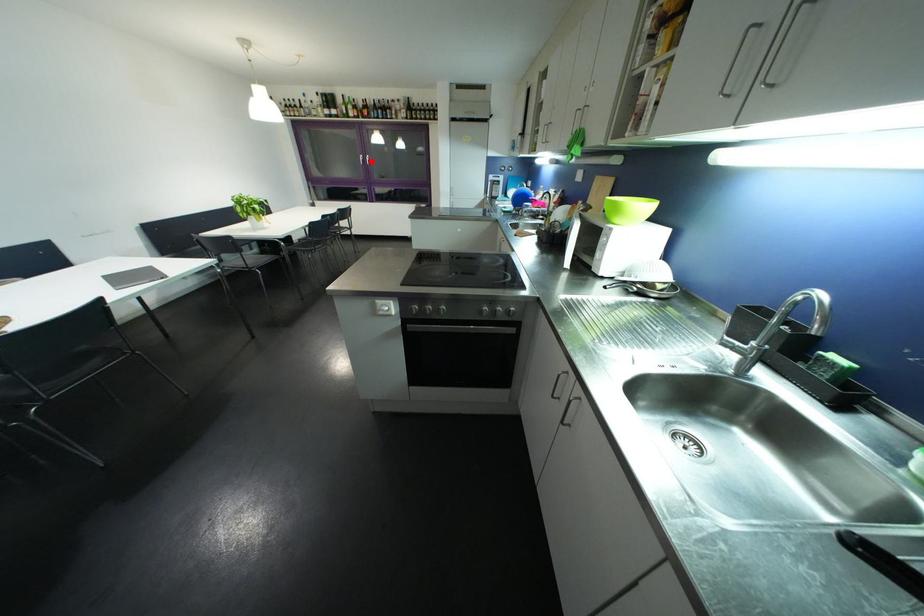
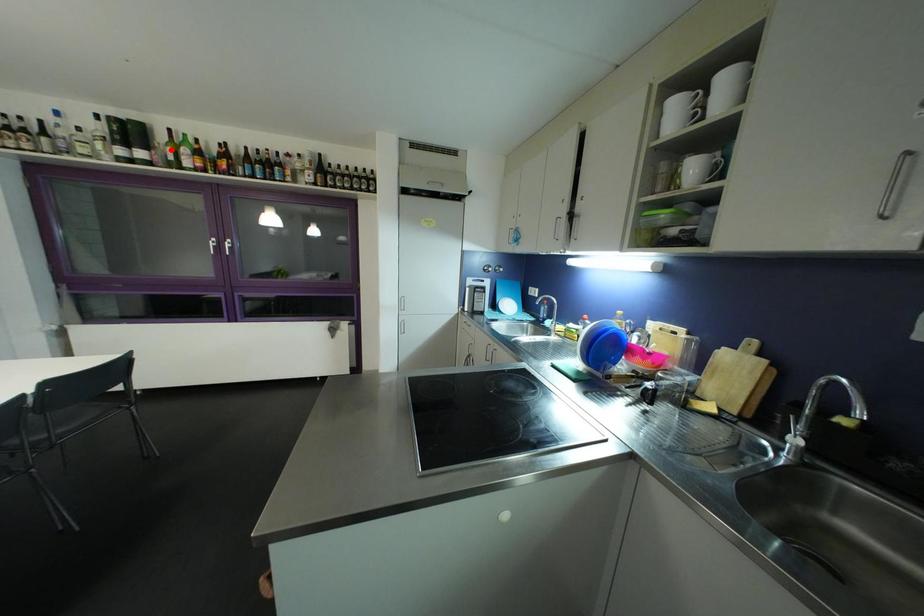
I am providing you with two images of the same scene from different viewpoints. A red point is marked on the first image and another point is marked on the second image. Is the marked point in image1 the same physical position as the marked point in image2?

No